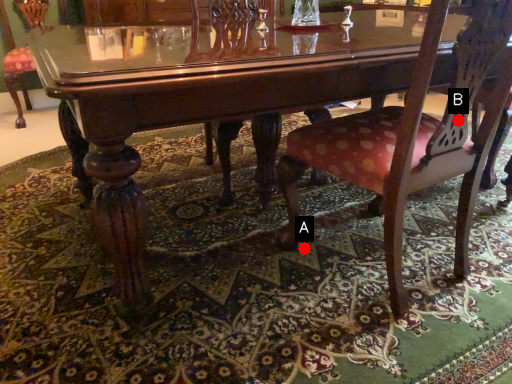
Question: Two points are circled on the image, labeled by A and B beside each circle. Among these points, which one is farthest from the camera?

Choices:
 (A) A is further
 (B) B is further

Answer: (A)